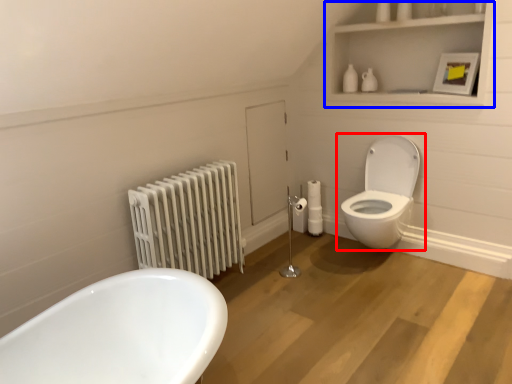
Question: Which object appears farthest to the camera in this image, toilet (highlighted by a red box) or medicine cabinet (highlighted by a blue box)?

Choices:
 (A) toilet
 (B) medicine cabinet

Answer: (A)